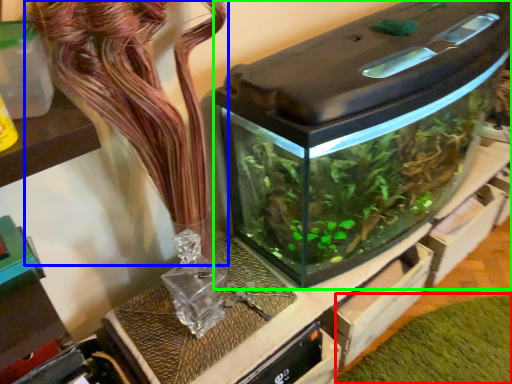
Question: Which is farther away from plant (highlighted by a red box)? flower (highlighted by a blue box) or water tank (highlighted by a green box)?

Choices:
 (A) flower
 (B) water tank

Answer: (A)